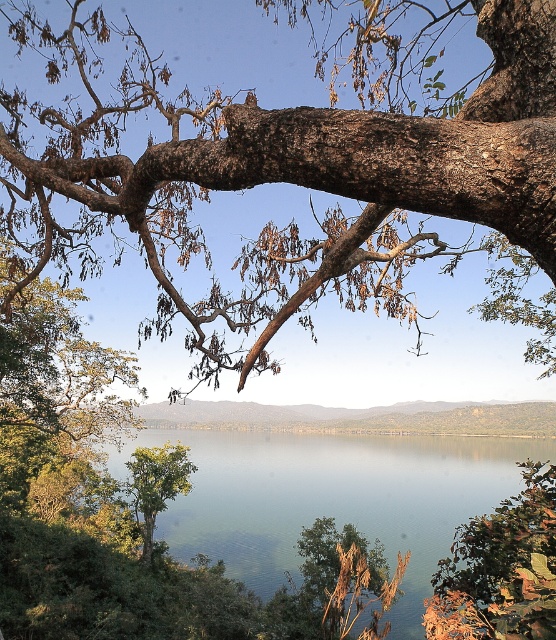
Who is higher up, clear water at center or green leafy tree at center?

Positioned higher is green leafy tree at center.

Which is more to the left, clear water at center or green leafy tree at center?

From the viewer's perspective, green leafy tree at center appears more on the left side.

Between point (444, 540) and point (178, 444), which one is positioned in front?

Positioned in front is point (444, 540).

I want to click on clear water at center, so tap(330, 493).

Can you confirm if brown rough tree branch at upper center is bigger than green matte leaves at lower right?

Indeed, brown rough tree branch at upper center has a larger size compared to green matte leaves at lower right.

Measure the distance between brown rough tree branch at upper center and camera.

brown rough tree branch at upper center and camera are 6.64 feet apart.

Where is `brown rough tree branch at upper center`? The image size is (556, 640). brown rough tree branch at upper center is located at coordinates (269, 176).

From the picture: Is green matte leaves at lower right behind green leafy tree at center?

No, green matte leaves at lower right is in front of green leafy tree at center.

Is green matte leaves at lower right positioned in front of green leafy tree at center?

Yes, green matte leaves at lower right is closer to the viewer.

Who is more forward, (485, 548) or (151, 451)?

Positioned in front is point (485, 548).

Locate an element on the screen. The height and width of the screenshot is (640, 556). green matte leaves at lower right is located at coordinates (500, 570).